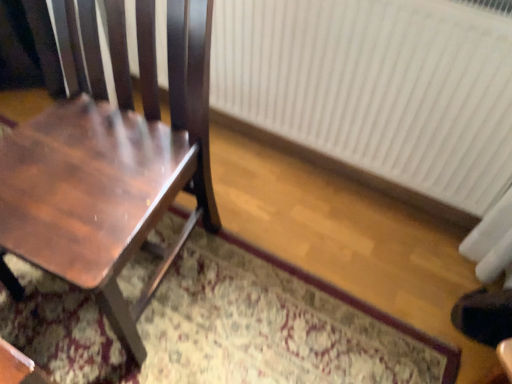
Question: From the image's perspective, is white plastic radiator at right over patterned carpet at center?

Choices:
 (A) no
 (B) yes

Answer: (B)

Question: Does white plastic radiator at right turn towards patterned carpet at center?

Choices:
 (A) no
 (B) yes

Answer: (B)

Question: Does white plastic radiator at right have a greater height compared to patterned carpet at center?

Choices:
 (A) no
 (B) yes

Answer: (B)

Question: Considering the relative positions of white plastic radiator at right and patterned carpet at center in the image provided, is white plastic radiator at right in front of patterned carpet at center?

Choices:
 (A) no
 (B) yes

Answer: (A)

Question: Does white plastic radiator at right have a lesser width compared to patterned carpet at center?

Choices:
 (A) no
 (B) yes

Answer: (B)

Question: Can patterned carpet at center be found inside white plastic radiator at right?

Choices:
 (A) no
 (B) yes

Answer: (A)

Question: From the image's perspective, is patterned carpet at center on top of white plastic radiator at right?

Choices:
 (A) yes
 (B) no

Answer: (B)

Question: Does patterned carpet at center have a lesser width compared to white plastic radiator at right?

Choices:
 (A) no
 (B) yes

Answer: (A)

Question: Would you say patterned carpet at center is outside white plastic radiator at right?

Choices:
 (A) yes
 (B) no

Answer: (A)

Question: From a real-world perspective, is patterned carpet at center located higher than white plastic radiator at right?

Choices:
 (A) no
 (B) yes

Answer: (A)

Question: Is white plastic radiator at right located within patterned carpet at center?

Choices:
 (A) yes
 (B) no

Answer: (B)

Question: Could you tell me if patterned carpet at center is turned towards white plastic radiator at right?

Choices:
 (A) no
 (B) yes

Answer: (A)

Question: Can you see white plastic radiator at right touching shiny brown wood chair at left?

Choices:
 (A) no
 (B) yes

Answer: (A)